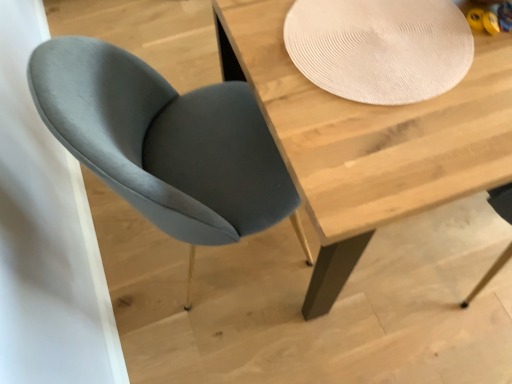
You are a GUI agent. You are given a task and a screenshot of the screen. Output one action in this format:
    pyautogui.click(x=<x>, y=<y>)
    Task: Click on the velvet grey chair at left
    
    Given the screenshot: What is the action you would take?
    pyautogui.click(x=165, y=142)

This screenshot has width=512, height=384. Describe the element at coordinates (165, 142) in the screenshot. I see `velvet grey chair at left` at that location.

The image size is (512, 384). What do you see at coordinates (368, 140) in the screenshot?
I see `wooden table at center` at bounding box center [368, 140].

You are a GUI agent. You are given a task and a screenshot of the screen. Output one action in this format:
    pyautogui.click(x=<x>, y=<y>)
    Task: Click on the velvet grey chair at left
    The width and height of the screenshot is (512, 384).
    Given the screenshot: What is the action you would take?
    pyautogui.click(x=165, y=142)

Between velvet grey chair at left and wooden table at center, which one has larger size?

wooden table at center.

From the image's perspective, is velvet grey chair at left positioned above or below wooden table at center?

Based on their image positions, velvet grey chair at left is located beneath wooden table at center.

Considering the sizes of objects velvet grey chair at left and wooden table at center in the image provided, who is wider, velvet grey chair at left or wooden table at center?

wooden table at center.

From a real-world perspective, which is physically above, velvet grey chair at left or wooden table at center?

From a 3D spatial view, velvet grey chair at left is above.

Based on the photo, what's the angular difference between wooden table at center and velvet grey chair at left's facing directions?

90.4 degrees separate the facing orientations of wooden table at center and velvet grey chair at left.

Is wooden table at center facing towards velvet grey chair at left?

No, wooden table at center is not oriented towards velvet grey chair at left.

Is the position of wooden table at center more distant than that of velvet grey chair at left?

Yes, wooden table at center is behind velvet grey chair at left.

Considering the relative sizes of wooden table at center and velvet grey chair at left in the image provided, is wooden table at center taller than velvet grey chair at left?

No.

From the image's perspective, relative to wooden table at center, is beige textured placemat at upper center above or below?

From the image's perspective, beige textured placemat at upper center appears above wooden table at center.

Considering the sizes of beige textured placemat at upper center and wooden table at center in the image, is beige textured placemat at upper center taller or shorter than wooden table at center?

Clearly, beige textured placemat at upper center is shorter compared to wooden table at center.

Which of these two, beige textured placemat at upper center or wooden table at center, is thinner?

Thinner between the two is beige textured placemat at upper center.

Would you say velvet grey chair at left is outside beige textured placemat at upper center?

That's correct, velvet grey chair at left is outside of beige textured placemat at upper center.

Is velvet grey chair at left shorter than beige textured placemat at upper center?

In fact, velvet grey chair at left may be taller than beige textured placemat at upper center.

Between wooden table at center and beige textured placemat at upper center, which one has less height?

beige textured placemat at upper center is shorter.

From the image's perspective, which one is positioned higher, wooden table at center or beige textured placemat at upper center?

beige textured placemat at upper center, from the image's perspective.

Between wooden table at center and beige textured placemat at upper center, which one has smaller size?

beige textured placemat at upper center.

Is beige textured placemat at upper center a part of wooden table at center?

That's correct, beige textured placemat at upper center is inside wooden table at center.

From a real-world perspective, which object rests below the other?

From a 3D spatial view, velvet grey chair at left is below.

What's the angular difference between beige textured placemat at upper center and velvet grey chair at left's facing directions?

They differ by 91.3 degrees in their facing directions.

Identify the location of chair below the beige textured placemat at upper center (from the image's perspective). (165, 142).

Is beige textured placemat at upper center in front of or behind velvet grey chair at left in the image?

Clearly, beige textured placemat at upper center is behind velvet grey chair at left.

Identify the location of table on the right of the velvet grey chair at left. (368, 140).

This screenshot has width=512, height=384. I want to click on chair on the left of wooden table at center, so click(165, 142).

When comparing their distances from wooden table at center, does beige textured placemat at upper center or velvet grey chair at left seem further?

Among the two, velvet grey chair at left is located further to wooden table at center.

Which object lies further to the anchor point beige textured placemat at upper center, velvet grey chair at left or wooden table at center?

Result: velvet grey chair at left is further to beige textured placemat at upper center.

Looking at the image, which one is located closer to velvet grey chair at left, beige textured placemat at upper center or wooden table at center?

The object closer to velvet grey chair at left is wooden table at center.

From the image, which object appears to be nearer to beige textured placemat at upper center, wooden table at center or velvet grey chair at left?

wooden table at center.

From the image, which object appears to be farther from velvet grey chair at left, wooden table at center or beige textured placemat at upper center?

beige textured placemat at upper center is positioned further to the anchor velvet grey chair at left.

When comparing their distances from wooden table at center, does velvet grey chair at left or beige textured placemat at upper center seem closer?

Among the two, beige textured placemat at upper center is located nearer to wooden table at center.

The image size is (512, 384). Identify the location of paper plate between velvet grey chair at left and wooden table at center. (380, 47).